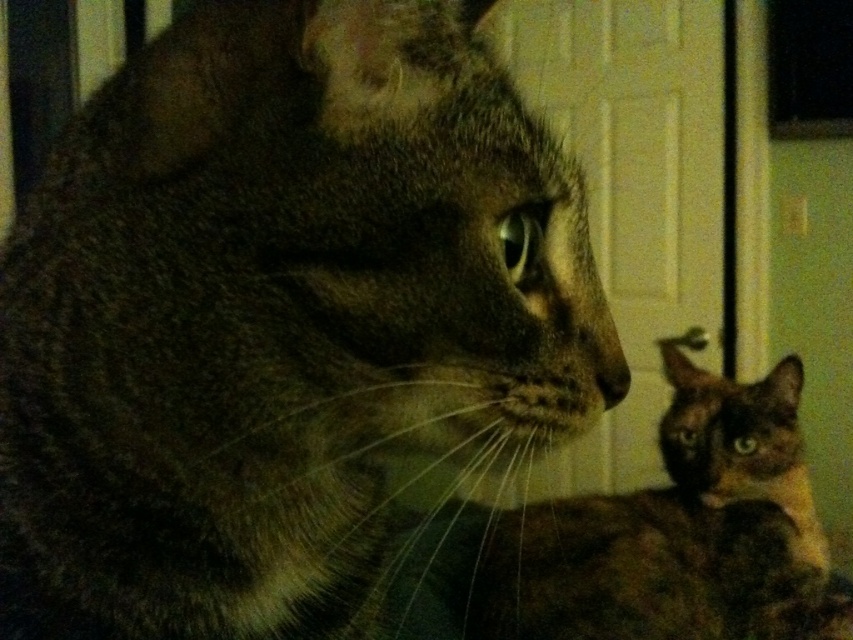
Question: Is dark brown fur cat at left below brown fur cat at lower right?

Choices:
 (A) no
 (B) yes

Answer: (A)

Question: Which object appears farthest from the camera in this image?

Choices:
 (A) dark brown fur cat at left
 (B) brown fur cat at lower right

Answer: (B)

Question: Is dark brown fur cat at left wider than brown fur cat at lower right?

Choices:
 (A) no
 (B) yes

Answer: (A)

Question: Does dark brown fur cat at left appear over brown fur cat at lower right?

Choices:
 (A) yes
 (B) no

Answer: (A)

Question: Which point is farther to the camera?

Choices:
 (A) (387, 33)
 (B) (769, 545)

Answer: (B)